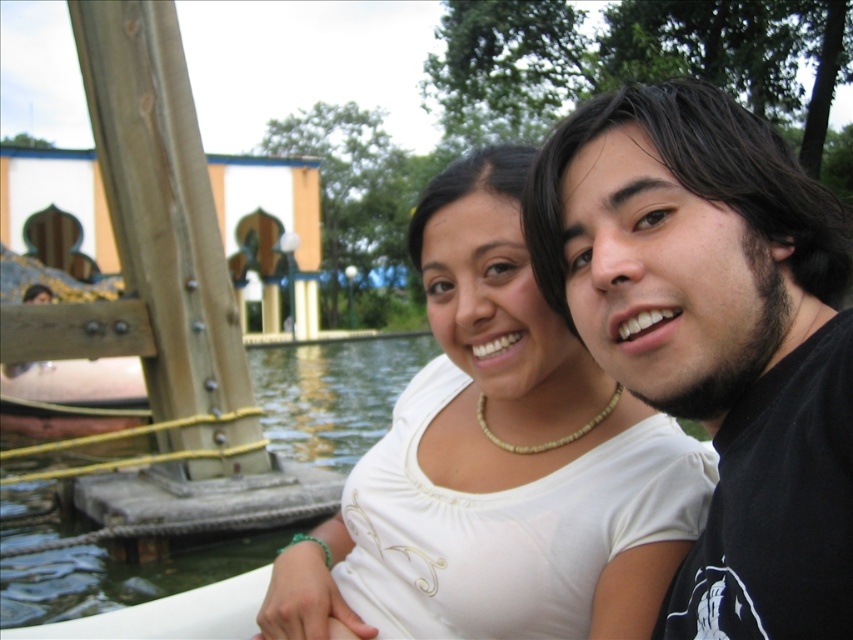
Can you confirm if black matte shirt at upper right is wider than white matte shirt at center?

No.

What do you see at coordinates (717, 336) in the screenshot? I see `black matte shirt at upper right` at bounding box center [717, 336].

The height and width of the screenshot is (640, 853). I want to click on black matte shirt at upper right, so click(x=717, y=336).